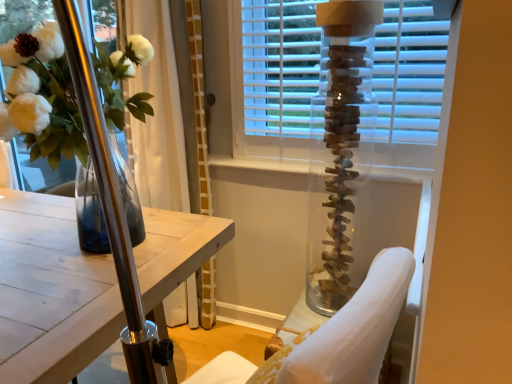
Find the location of a particular element. The image size is (512, 384). wooden table at center is located at coordinates (51, 292).

The image size is (512, 384). What do you see at coordinates (51, 292) in the screenshot?
I see `wooden table at center` at bounding box center [51, 292].

You are a GUI agent. You are given a task and a screenshot of the screen. Output one action in this format:
    pyautogui.click(x=<x>, y=<y>)
    Task: Click on the wooden table at center
    Image resolution: width=512 pixels, height=384 pixels.
    Given the screenshot: What is the action you would take?
    pyautogui.click(x=51, y=292)